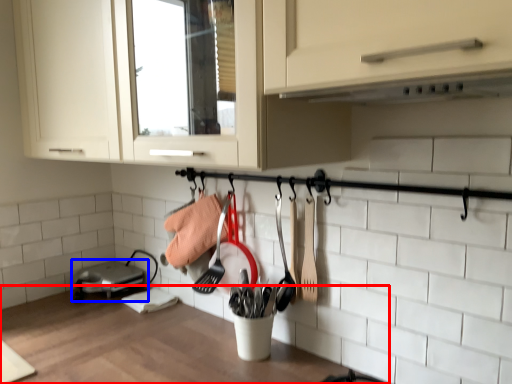
Question: Which point is closer to the camera, countertop (highlighted by a red box) or home appliance (highlighted by a blue box)?

Choices:
 (A) countertop
 (B) home appliance

Answer: (A)